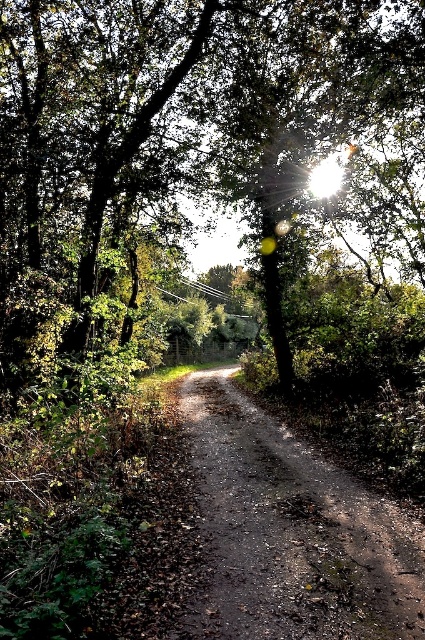
Question: Is green leafy tree at center to the right of dusty brown dirt track at center from the viewer's perspective?

Choices:
 (A) yes
 (B) no

Answer: (A)

Question: Which point is closer to the camera taking this photo?

Choices:
 (A) (260, 566)
 (B) (328, 58)

Answer: (A)

Question: Which point appears closest to the camera in this image?

Choices:
 (A) (214, 579)
 (B) (217, 205)

Answer: (A)

Question: Is green leafy tree at center thinner than dusty brown dirt track at center?

Choices:
 (A) no
 (B) yes

Answer: (A)

Question: Does green leafy tree at center come behind dusty brown dirt track at center?

Choices:
 (A) no
 (B) yes

Answer: (B)